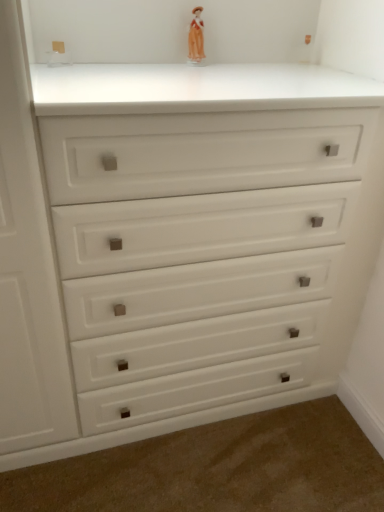
What do you see at coordinates (196, 37) in the screenshot? I see `matte porcelain doll at upper center` at bounding box center [196, 37].

Where is `matte porcelain doll at upper center`? The image size is (384, 512). matte porcelain doll at upper center is located at coordinates (196, 37).

What is the approximate width of matte porcelain doll at upper center?

7.32 centimeters.

Where is `matte porcelain doll at upper center`? matte porcelain doll at upper center is located at coordinates (196, 37).